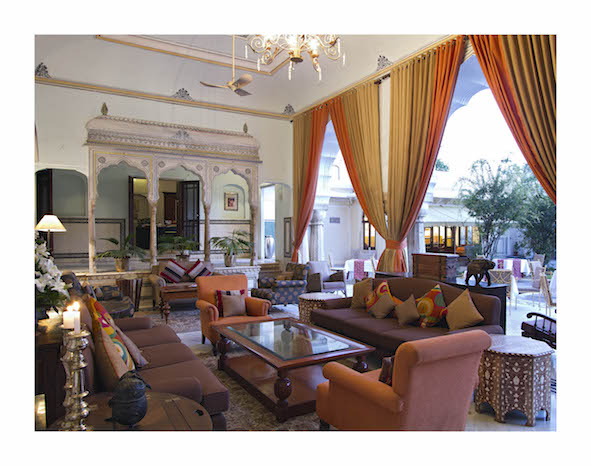
Identify the location of rugs. (249, 407), (180, 316).